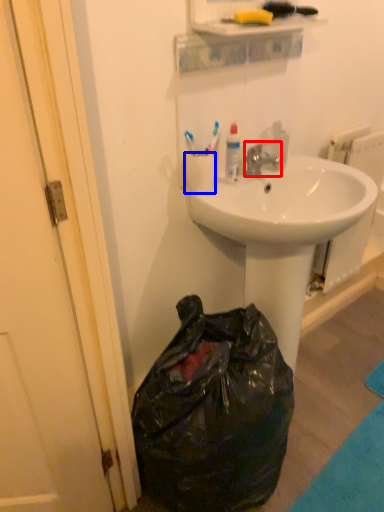
Question: Which object appears closest to the camera in this image, faucet (highlighted by a red box) or coffee cup (highlighted by a blue box)?

Choices:
 (A) faucet
 (B) coffee cup

Answer: (B)